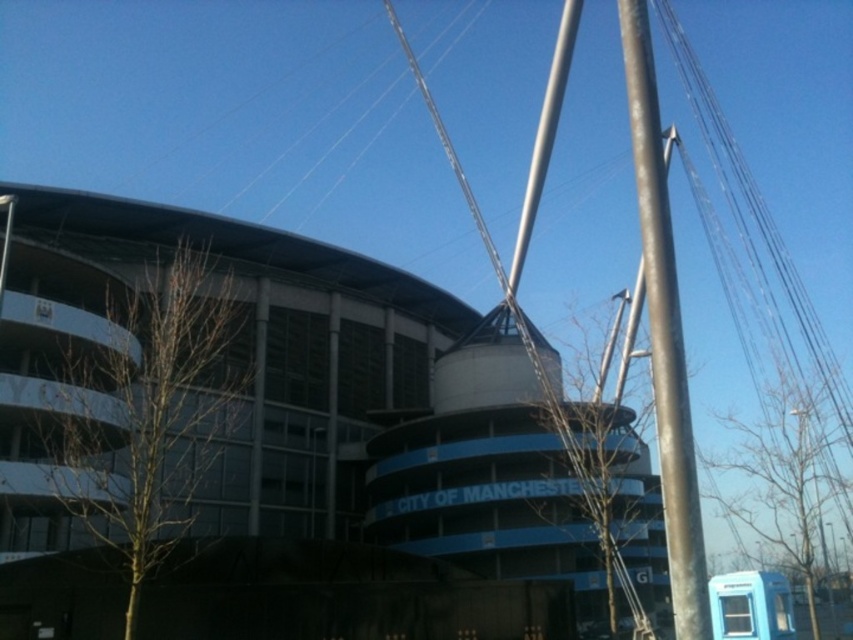
Which of these two, white concrete stadium at center or blue plastic bus stop at lower right, stands taller?

Standing taller between the two is white concrete stadium at center.

Is point (347, 372) more distant than point (712, 611)?

Yes.

Is point (418, 445) positioned before point (717, 584)?

No.

Locate an element on the screen. white concrete stadium at center is located at coordinates (265, 444).

Is point (22, 442) farther from viewer compared to point (637, 6)?

Yes, it is.

Can you confirm if white concrete stadium at center is positioned to the left of metallic pole at right?

Yes, white concrete stadium at center is to the left of metallic pole at right.

Is point (38, 536) farther from viewer compared to point (659, 164)?

Yes, point (38, 536) is farther from viewer.

The width and height of the screenshot is (853, 640). Identify the location of white concrete stadium at center. [x=265, y=444].

Can you confirm if metallic pole at right is thinner than blue plastic bus stop at lower right?

No.

Identify the location of metallic pole at right. The width and height of the screenshot is (853, 640). (664, 333).

The image size is (853, 640). What are the coordinates of `metallic pole at right` in the screenshot? It's located at (664, 333).

You are a GUI agent. You are given a task and a screenshot of the screen. Output one action in this format:
    pyautogui.click(x=<x>, y=<y>)
    Task: Click on the metallic pole at right
    
    Given the screenshot: What is the action you would take?
    pyautogui.click(x=664, y=333)